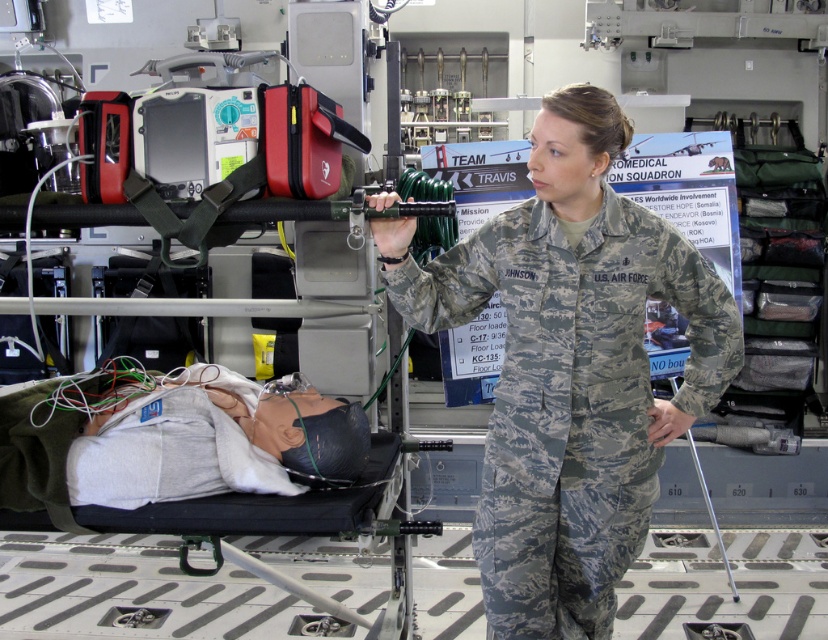
Question: Is camouflage uniform at center smaller than camouflage fabric stretcher at center?

Choices:
 (A) yes
 (B) no

Answer: (A)

Question: Is camouflage uniform at center thinner than camouflage fabric stretcher at center?

Choices:
 (A) yes
 (B) no

Answer: (A)

Question: Which of the following is the closest to the observer?

Choices:
 (A) camouflage uniform at center
 (B) camouflage fabric stretcher at center

Answer: (A)

Question: Does camouflage uniform at center have a smaller size compared to camouflage fabric stretcher at center?

Choices:
 (A) yes
 (B) no

Answer: (A)